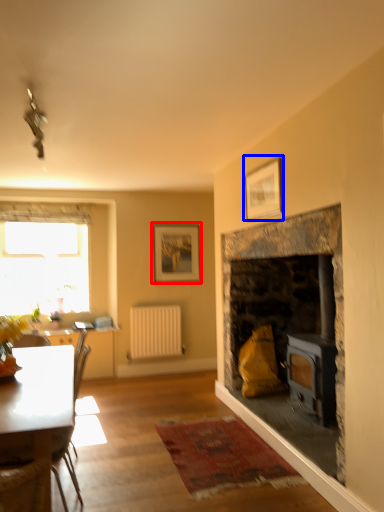
Question: Which point is further to the camera, picture frame (highlighted by a red box) or picture frame (highlighted by a blue box)?

Choices:
 (A) picture frame
 (B) picture frame

Answer: (A)